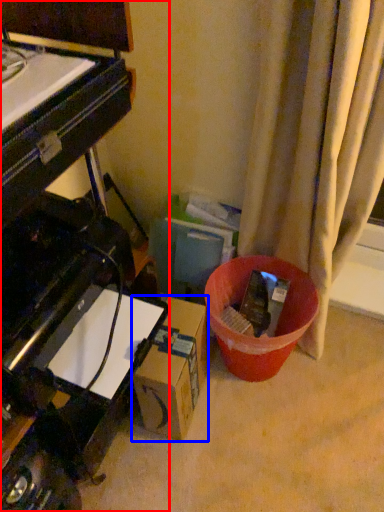
Question: Which point is closer to the camera, piano (highlighted by a red box) or cardboard box (highlighted by a blue box)?

Choices:
 (A) piano
 (B) cardboard box

Answer: (A)